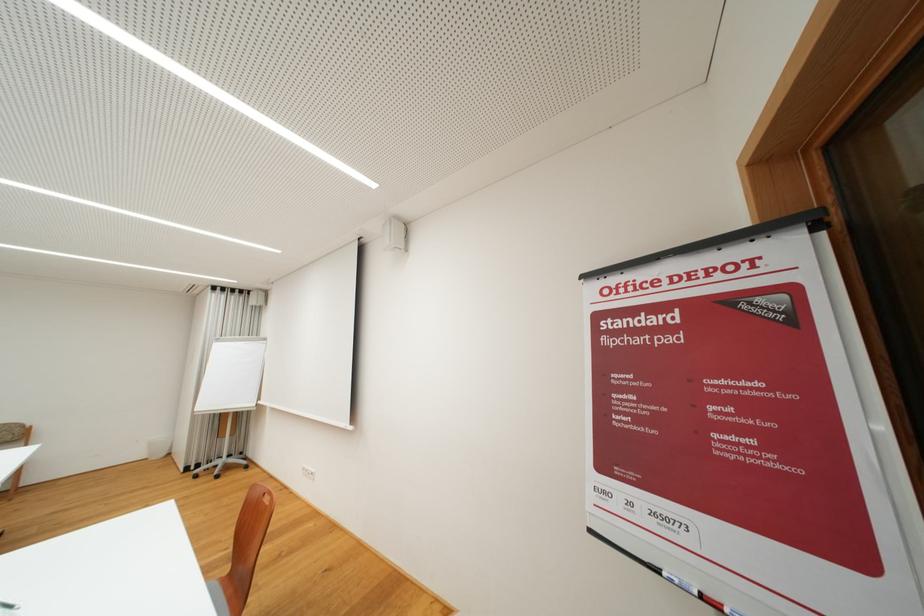
What are the coordinates of `whiteboard stand wheel` in the screenshot? It's located at (220, 466).